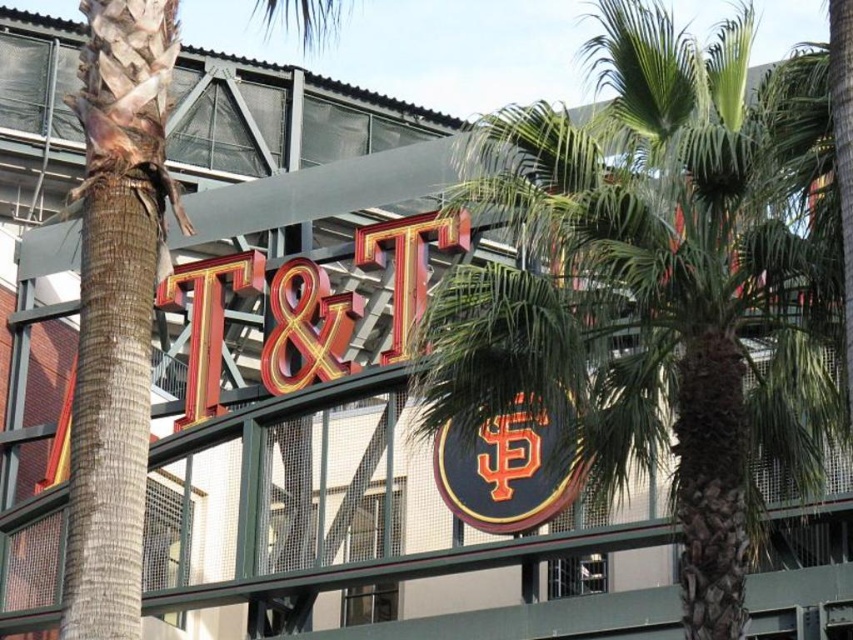
You are standing in front of the building and want to locate the green leafy palm tree at left. What are the coordinates where you should look?

The green leafy palm tree at left is located at coordinates point [115,305].

You are standing at the point marked as point [154,136] and want to take a photo of the entire building facade. Considering your current position, will you be able to capture the entire structure in one shot without moving? Please explain your reasoning based on the distance provided.

The point [154,136] is 44.38 meters away from the viewer. Since the building facade is part of the structure, being at this distance allows the viewer to capture the entire building facade in one shot without needing to move, as 44.38 meters is a sufficient distance to frame the entire structure in a standard camera lens.